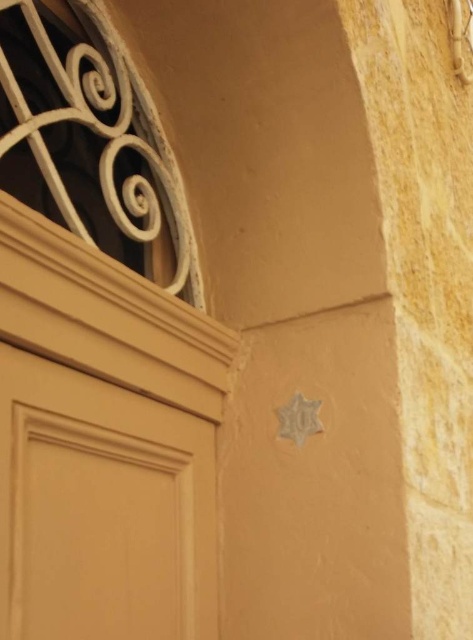
Does matte wood door at lower left have a greater width compared to white matte spiral at upper left?

In fact, matte wood door at lower left might be narrower than white matte spiral at upper left.

Does matte wood door at lower left appear on the right side of white matte spiral at upper left?

Indeed, matte wood door at lower left is positioned on the right side of white matte spiral at upper left.

The width and height of the screenshot is (473, 640). What are the coordinates of `matte wood door at lower left` in the screenshot? It's located at (102, 509).

The image size is (473, 640). What are the coordinates of `matte wood door at lower left` in the screenshot? It's located at (102, 509).